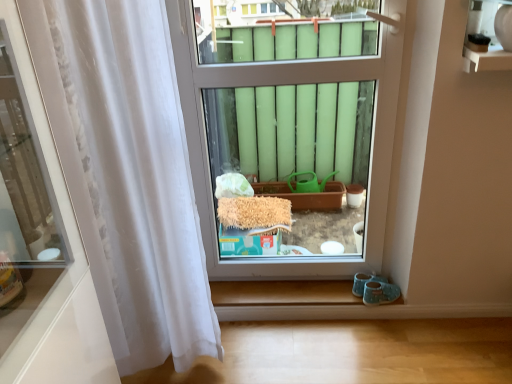
Question: From the image's perspective, is transparent glass window at center above or below white sheer curtain at left?

Choices:
 (A) below
 (B) above

Answer: (B)

Question: Does point (231, 72) appear closer or farther from the camera than point (99, 49)?

Choices:
 (A) farther
 (B) closer

Answer: (A)

Question: Considering their positions, is transparent glass window at center located in front of or behind white sheer curtain at left?

Choices:
 (A) front
 (B) behind

Answer: (B)

Question: From the image's perspective, is white sheer curtain at left located above or below transparent glass window at center?

Choices:
 (A) below
 (B) above

Answer: (A)

Question: Do you think white sheer curtain at left is within transparent glass window at center, or outside of it?

Choices:
 (A) inside
 (B) outside

Answer: (B)

Question: Is white sheer curtain at left wider or thinner than transparent glass window at center?

Choices:
 (A) wide
 (B) thin

Answer: (A)

Question: Looking at the image, does white sheer curtain at left seem bigger or smaller compared to transparent glass window at center?

Choices:
 (A) big
 (B) small

Answer: (A)